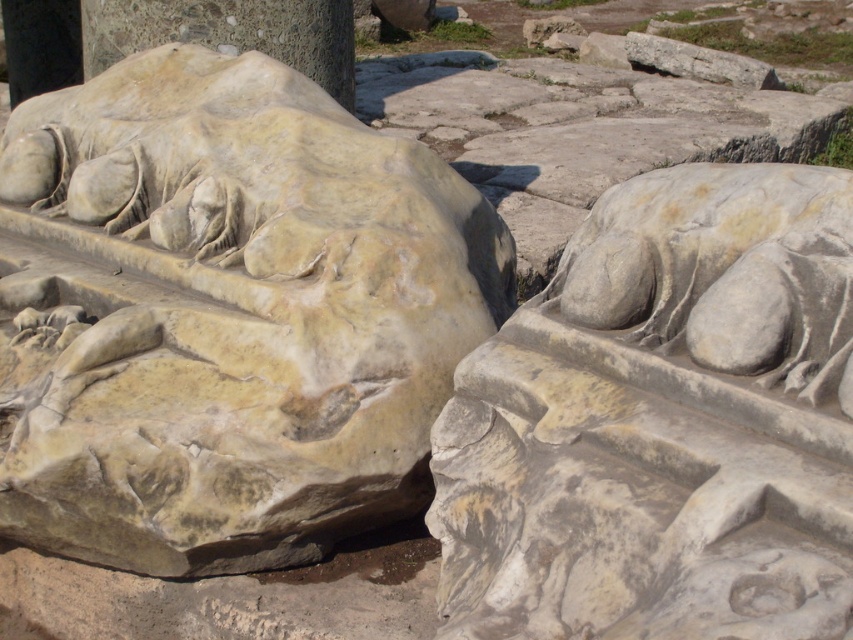
Is gray stone sculpture at center thinner than smooth gray stone at center?

Yes.

Does gray stone sculpture at center have a larger size compared to smooth gray stone at center?

Indeed, gray stone sculpture at center has a larger size compared to smooth gray stone at center.

The height and width of the screenshot is (640, 853). What do you see at coordinates (663, 422) in the screenshot? I see `gray stone sculpture at center` at bounding box center [663, 422].

Locate an element on the screen. The height and width of the screenshot is (640, 853). gray stone sculpture at center is located at coordinates (663, 422).

Who is positioned more to the left, matte stone sculpture at center or smooth gray stone at center?

smooth gray stone at center is more to the left.

Does matte stone sculpture at center have a lesser width compared to smooth gray stone at center?

No.

Where is `matte stone sculpture at center`? matte stone sculpture at center is located at coordinates (225, 314).

Which is in front, point (76, 228) or point (737, 416)?

Point (737, 416) is more forward.

In the scene shown: Is matte stone sculpture at center taller than gray stone sculpture at center?

Yes, matte stone sculpture at center is taller than gray stone sculpture at center.

Locate an element on the screen. matte stone sculpture at center is located at coordinates (225, 314).